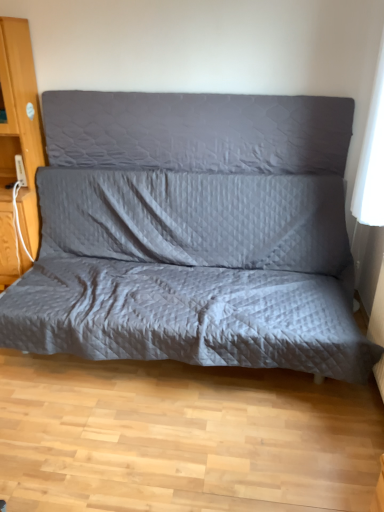
Question: Is quilted gray studio couch at center at the back of wooden dresser at left?

Choices:
 (A) no
 (B) yes

Answer: (A)

Question: From a real-world perspective, is wooden dresser at left beneath quilted gray studio couch at center?

Choices:
 (A) no
 (B) yes

Answer: (A)

Question: Is wooden dresser at left thinner than quilted gray studio couch at center?

Choices:
 (A) no
 (B) yes

Answer: (B)

Question: Is wooden dresser at left surrounding quilted gray studio couch at center?

Choices:
 (A) yes
 (B) no

Answer: (B)

Question: Would you say wooden dresser at left is outside quilted gray studio couch at center?

Choices:
 (A) yes
 (B) no

Answer: (A)

Question: From the image's perspective, is wooden dresser at left located beneath quilted gray studio couch at center?

Choices:
 (A) no
 (B) yes

Answer: (A)

Question: Does quilted gray studio couch at center have a larger size compared to gray quilted pillow at center?

Choices:
 (A) no
 (B) yes

Answer: (B)

Question: From a real-world perspective, is quilted gray studio couch at center physically above gray quilted pillow at center?

Choices:
 (A) no
 (B) yes

Answer: (A)

Question: Is quilted gray studio couch at center taller than gray quilted pillow at center?

Choices:
 (A) yes
 (B) no

Answer: (A)

Question: Is quilted gray studio couch at center wider than gray quilted pillow at center?

Choices:
 (A) no
 (B) yes

Answer: (B)

Question: Considering the relative positions of quilted gray studio couch at center and gray quilted pillow at center in the image provided, is quilted gray studio couch at center to the left of gray quilted pillow at center from the viewer's perspective?

Choices:
 (A) yes
 (B) no

Answer: (A)

Question: From the image's perspective, is quilted gray studio couch at center below gray quilted pillow at center?

Choices:
 (A) no
 (B) yes

Answer: (B)

Question: From the image's perspective, is gray quilted pillow at center below wooden dresser at left?

Choices:
 (A) no
 (B) yes

Answer: (A)